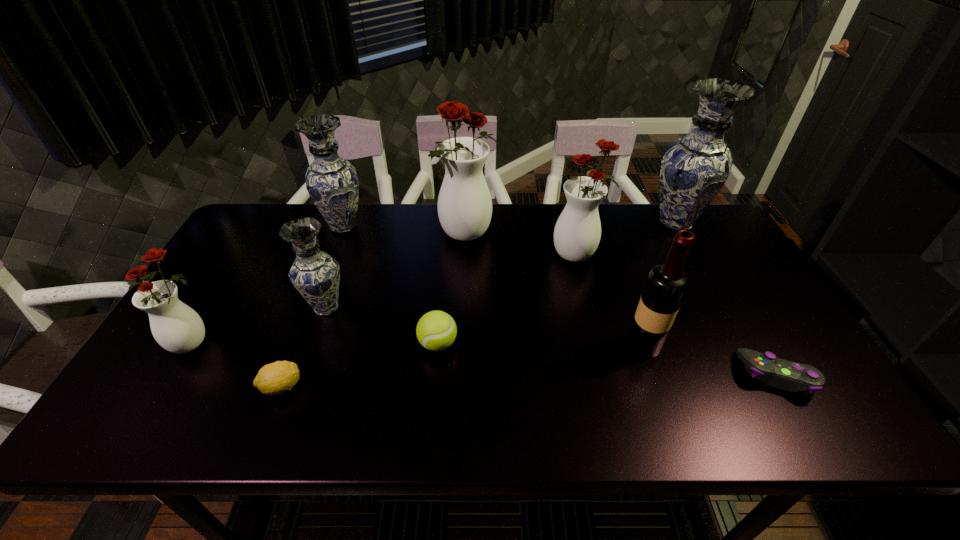
The width and height of the screenshot is (960, 540). I want to click on vacant region located 0.140m on the right of the wine bottle, so click(x=716, y=345).

Identify the location of free space located 0.110m on the right of the sixth nearest object. This screenshot has width=960, height=540. (388, 308).

You are a GUI agent. You are given a task and a screenshot of the screen. Output one action in this format:
    pyautogui.click(x=<x>, y=<y>)
    Task: Click on the free point located on the back of the leftmost vase
    The image size is (960, 540).
    Given the screenshot: What is the action you would take?
    pyautogui.click(x=237, y=267)

What are the coordinates of `vacant region located 0.290m on the back of the third shortest object` in the screenshot? It's located at (445, 256).

Find the location of `free space located 0.200m at the stem end of the lemon`. free space located 0.200m at the stem end of the lemon is located at coordinates (390, 387).

Find the location of `vacant space located on the left of the gray control`. vacant space located on the left of the gray control is located at coordinates (698, 375).

The image size is (960, 540). Identify the location of lemon located in the near edge section of the desktop. (275, 378).

This screenshot has height=540, width=960. In order to click on control present at the near edge in this screenshot , I will do `click(790, 376)`.

Where is `object located at the left edge`? object located at the left edge is located at coordinates (176, 327).

This screenshot has height=540, width=960. I want to click on vase present at the right edge, so coord(695,167).